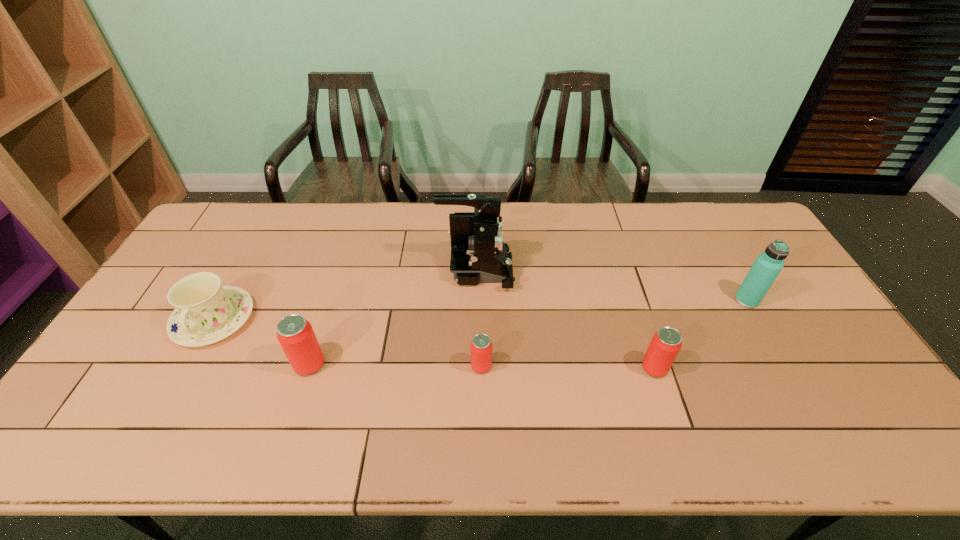
Where is `vacant space at the left edge of the desktop`? The width and height of the screenshot is (960, 540). vacant space at the left edge of the desktop is located at coordinates (177, 270).

Locate an element on the screen. The image size is (960, 540). blank space at the right edge of the desktop is located at coordinates (816, 354).

Find the location of `free space at the near left corner`. free space at the near left corner is located at coordinates (144, 396).

Where is `blank space at the far right corner of the desktop`? The height and width of the screenshot is (540, 960). blank space at the far right corner of the desktop is located at coordinates (731, 223).

Where is `unoccupied area between the shortest beer can and the tallest beer can`? unoccupied area between the shortest beer can and the tallest beer can is located at coordinates (396, 366).

Where is `free area in between the chinaware and the fifth object from left to right`? The width and height of the screenshot is (960, 540). free area in between the chinaware and the fifth object from left to right is located at coordinates (434, 344).

The height and width of the screenshot is (540, 960). I want to click on free space between the second shortest beer can and the rightmost object, so click(x=701, y=334).

Identify the location of empty space between the chinaware and the thermos bottle. (480, 310).

Find the location of a particular element. vacant space that's between the tallest object and the shortest beer can is located at coordinates (479, 319).

Find the location of `free area in between the second shortest beer can and the leftmost object`. free area in between the second shortest beer can and the leftmost object is located at coordinates (434, 344).